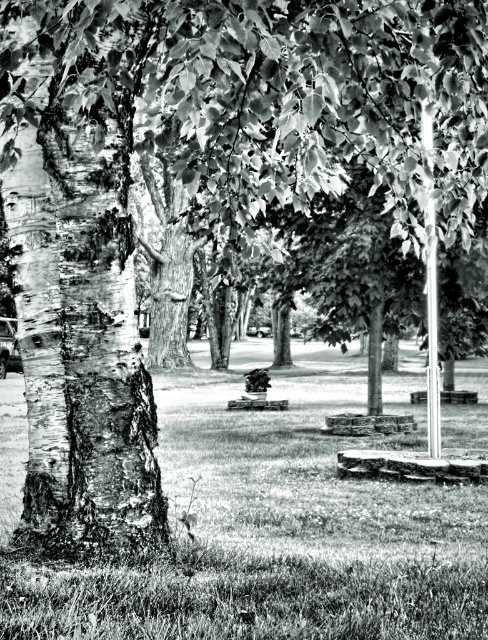
Is barky white tree trunk at left thinner than metallic pole at upper right?

Yes.

Is barky white tree trunk at left positioned before metallic pole at upper right?

Yes, barky white tree trunk at left is closer to the viewer.

Which is behind, point (29, 417) or point (430, 134)?

The point (430, 134) is more distant.

The height and width of the screenshot is (640, 488). I want to click on barky white tree trunk at left, so click(82, 348).

In the scene shown: Can you confirm if grassy lawn at center is taller than barky white tree trunk at left?

Incorrect, grassy lawn at center's height is not larger of barky white tree trunk at left's.

Does grassy lawn at center have a greater width compared to barky white tree trunk at left?

Yes, grassy lawn at center is wider than barky white tree trunk at left.

Which is in front, point (273, 474) or point (63, 163)?

Point (63, 163) is in front.

Image resolution: width=488 pixels, height=640 pixels. Find the location of `grassy lawn at center`. grassy lawn at center is located at coordinates (x=280, y=529).

Does grassy lawn at center have a lesser width compared to metallic pole at upper right?

Incorrect, grassy lawn at center's width is not less than metallic pole at upper right's.

Is grassy lawn at center positioned behind metallic pole at upper right?

No, grassy lawn at center is in front of metallic pole at upper right.

Between point (267, 444) and point (432, 208), which one is positioned in front?

Point (432, 208) is more forward.

At what (x,y) coordinates should I click in order to perform the action: click on grassy lawn at center. Please return your answer as a coordinate pair (x, y). The width and height of the screenshot is (488, 640). Looking at the image, I should click on (280, 529).